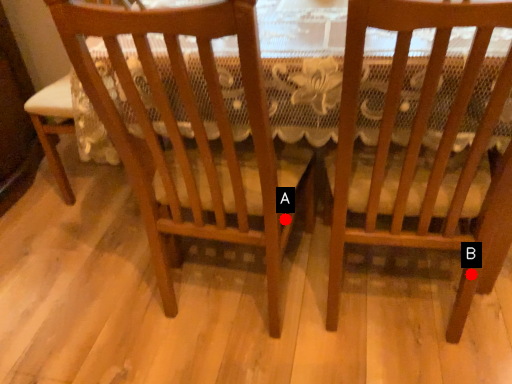
Question: Two points are circled on the image, labeled by A and B beside each circle. Which point is closer to the camera?

Choices:
 (A) A is closer
 (B) B is closer

Answer: (B)